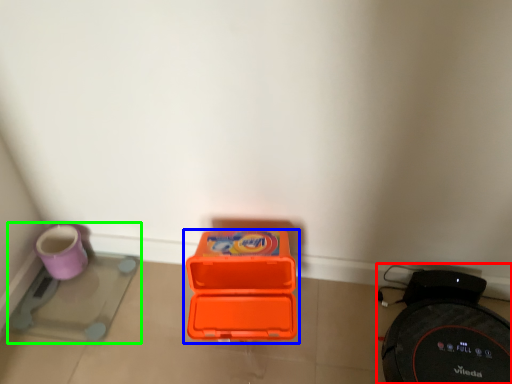
Question: Which object is the farthest from appliance (highlighted by a red box)? Choose among these: box (highlighted by a blue box) or appliance (highlighted by a green box).

Choices:
 (A) box
 (B) appliance

Answer: (B)